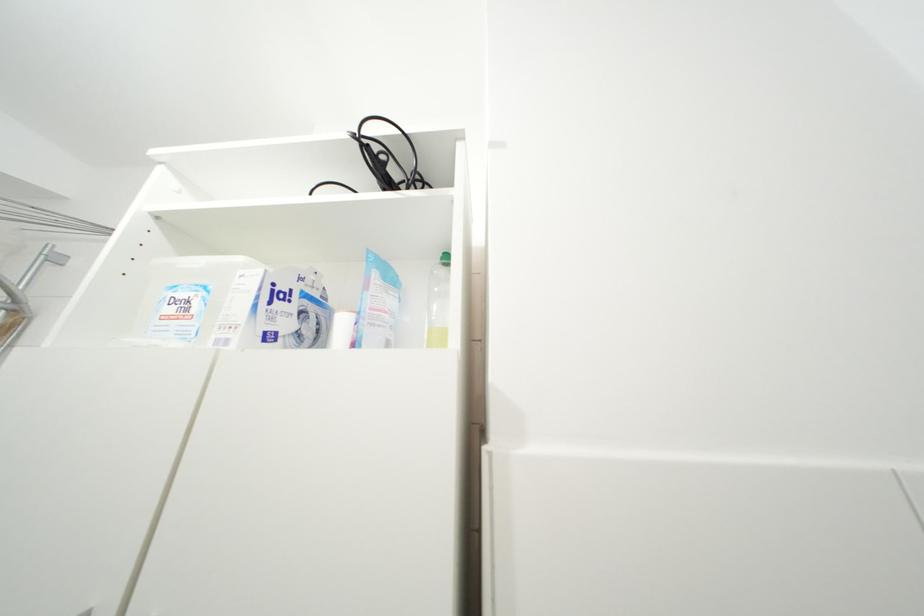
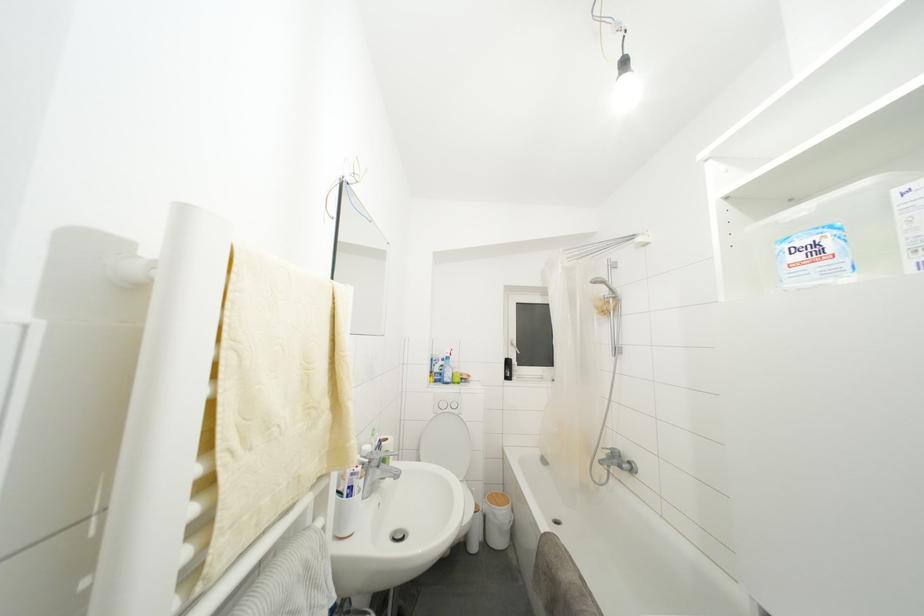
Question: The camera is either moving clockwise (left) or counter-clockwise (right) around the object. The first image is from the beginning of the video and the second image is from the end. Is the camera moving left or right when shooting the video?

Choices:
 (A) Left
 (B) Right

Answer: (B)